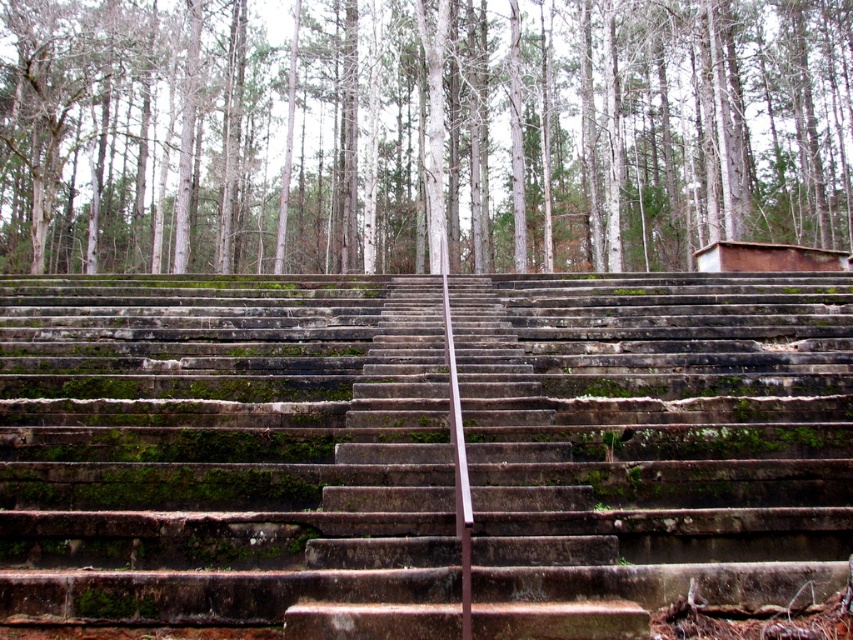
Question: Can you confirm if dark gray concrete stairs at center is positioned to the right of white bark trees at upper center?

Choices:
 (A) no
 (B) yes

Answer: (B)

Question: Which of the following is the farthest from the observer?

Choices:
 (A) dark gray concrete stairs at center
 (B) white bark trees at upper center

Answer: (B)

Question: Which of the following is the farthest from the observer?

Choices:
 (A) coord(242,449)
 (B) coord(804,48)

Answer: (B)

Question: Is dark gray concrete stairs at center to the left of white bark trees at upper center from the viewer's perspective?

Choices:
 (A) yes
 (B) no

Answer: (B)

Question: Can you confirm if dark gray concrete stairs at center is positioned to the right of white bark trees at upper center?

Choices:
 (A) no
 (B) yes

Answer: (B)

Question: Among these objects, which one is farthest from the camera?

Choices:
 (A) dark gray concrete stairs at center
 (B) white bark trees at upper center

Answer: (B)